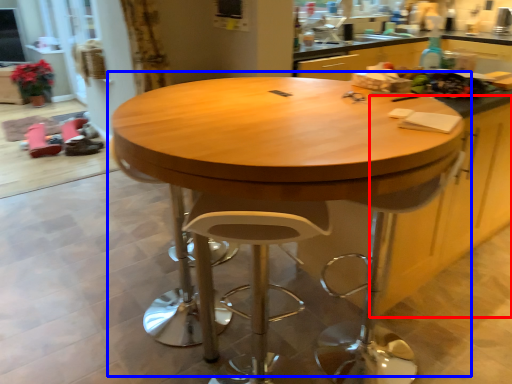
Question: Which of the following is the closest to the observer, cabinetry (highlighted by a red box) or table (highlighted by a blue box)?

Choices:
 (A) cabinetry
 (B) table

Answer: (B)